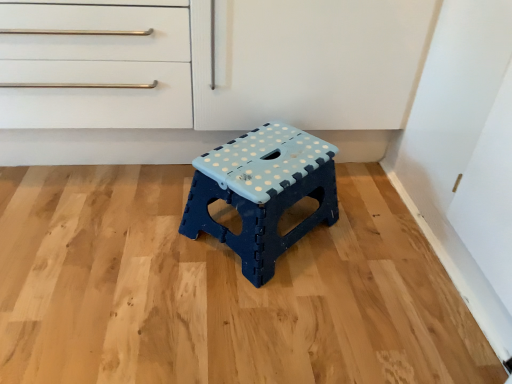
Locate an element on the screen. This screenshot has width=512, height=384. blank area to the left of blue plastic stool at center is located at coordinates (135, 229).